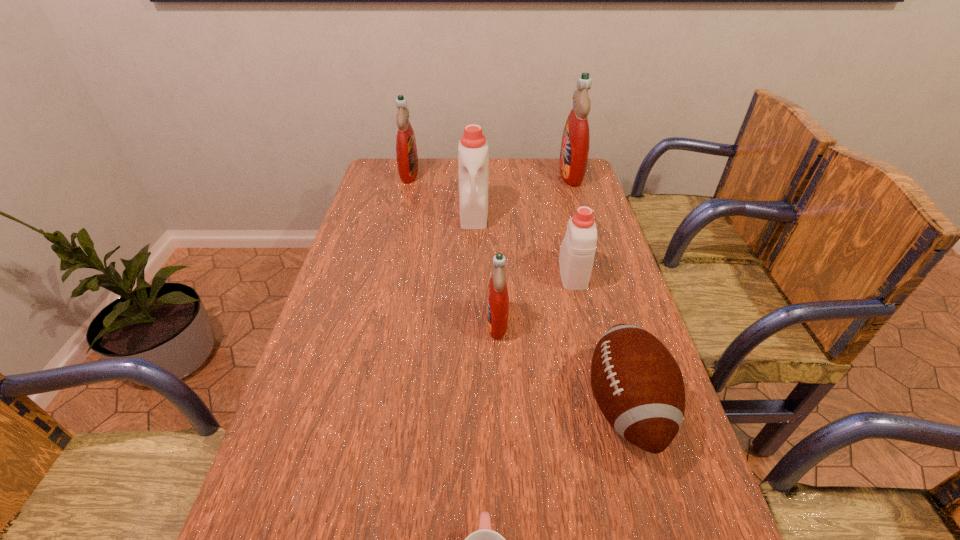
Choose which detergent is the nearest neighbor to the left white detergent. Please provide its 2D coordinates. Your answer should be formatted as a tuple, i.e. [(x, y)], where the tuple contains the x and y coordinates of a point satisfying the conditions above.

[(406, 149)]

This screenshot has height=540, width=960. I want to click on red detergent that stands as the second closest to the football, so click(574, 152).

This screenshot has width=960, height=540. I want to click on red detergent that is the nearest to the leftmost red detergent, so click(574, 152).